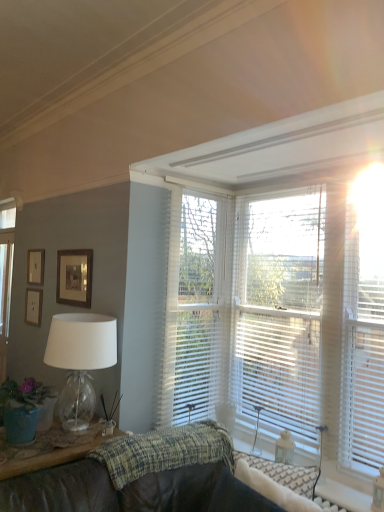
Question: Is white textured blinds at upper right to the left of wooden picture frame at upper left, marked as the 3th picture frame in a front-to-back arrangement, from the viewer's perspective?

Choices:
 (A) yes
 (B) no

Answer: (B)

Question: Could you tell me if white textured blinds at upper right is turned towards wooden picture frame at upper left, which appears as the third picture frame when viewed from the right?

Choices:
 (A) yes
 (B) no

Answer: (B)

Question: Would you say white textured blinds at upper right is a long distance from wooden picture frame at upper left, marked as the 3th picture frame in a front-to-back arrangement?

Choices:
 (A) no
 (B) yes

Answer: (B)

Question: From the image's perspective, is white textured blinds at upper right under wooden picture frame at upper left, which is counted as the 1th picture frame, starting from the back?

Choices:
 (A) yes
 (B) no

Answer: (B)

Question: Considering the relative sizes of white textured blinds at upper right and wooden picture frame at upper left, marked as the 3th picture frame in a front-to-back arrangement, in the image provided, is white textured blinds at upper right taller than wooden picture frame at upper left, marked as the 3th picture frame in a front-to-back arrangement,?

Choices:
 (A) yes
 (B) no

Answer: (A)

Question: Considering their positions, is textured woven blanket at center located in front of or behind wooden picture frame at upper left, positioned as the 2th picture frame in left-to-right order?

Choices:
 (A) behind
 (B) front

Answer: (B)

Question: Based on their sizes in the image, would you say textured woven blanket at center is bigger or smaller than wooden picture frame at upper left, marked as the 2th picture frame in a front-to-back arrangement?

Choices:
 (A) small
 (B) big

Answer: (B)

Question: In terms of height, does textured woven blanket at center look taller or shorter compared to wooden picture frame at upper left, which is the second picture frame from right to left?

Choices:
 (A) tall
 (B) short

Answer: (B)

Question: Is point (160, 460) positioned closer to the camera than point (38, 257)?

Choices:
 (A) closer
 (B) farther

Answer: (A)

Question: Relative to wooden picture frame at upper left, which is the second picture frame from right to left, is matte green pot at lower left in front or behind?

Choices:
 (A) behind
 (B) front

Answer: (B)

Question: Based on their sizes in the image, would you say matte green pot at lower left is bigger or smaller than wooden picture frame at upper left, marked as the 2th picture frame in a front-to-back arrangement?

Choices:
 (A) big
 (B) small

Answer: (A)

Question: From a real-world perspective, is matte green pot at lower left above or below wooden picture frame at upper left, which is the second picture frame from right to left?

Choices:
 (A) above
 (B) below

Answer: (B)

Question: Is matte green pot at lower left taller or shorter than wooden picture frame at upper left, marked as the 2th picture frame in a front-to-back arrangement?

Choices:
 (A) tall
 (B) short

Answer: (A)

Question: Is point (57, 265) closer or farther from the camera than point (31, 317)?

Choices:
 (A) farther
 (B) closer

Answer: (B)

Question: Looking at the image, does wooden framed picture at upper left, placed as the third picture frame when sorted from back to front, seem bigger or smaller compared to wooden picture frame at upper left, marked as the 3th picture frame in a front-to-back arrangement?

Choices:
 (A) big
 (B) small

Answer: (A)